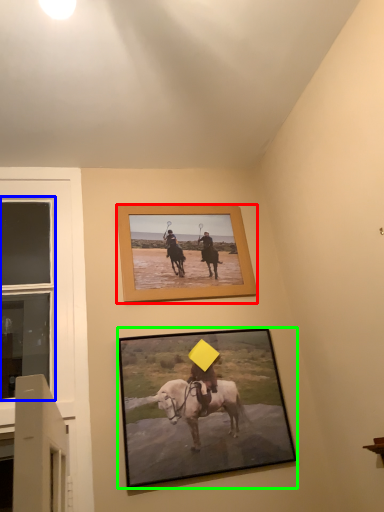
Question: Based on their relative distances, which object is farther from picture frame (highlighted by a red box)? Choose from window (highlighted by a blue box) and picture frame (highlighted by a green box).

Choices:
 (A) window
 (B) picture frame

Answer: (A)